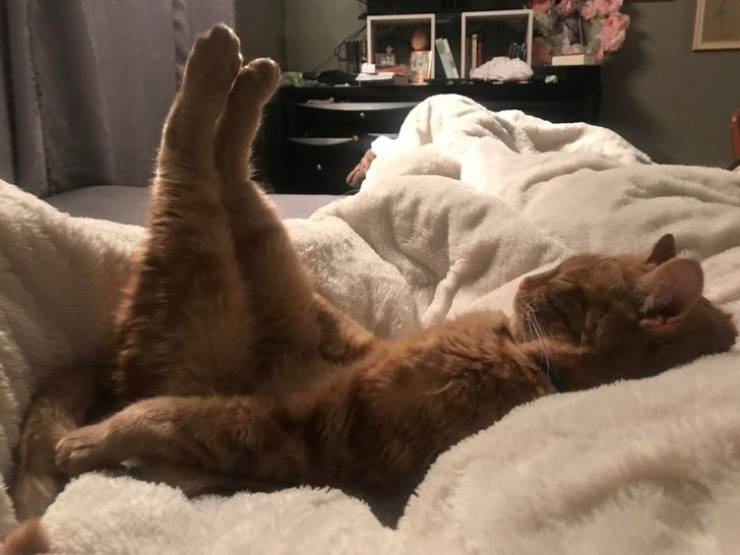
Find the location of a particular element. The height and width of the screenshot is (555, 740). curtains is located at coordinates (47, 170).